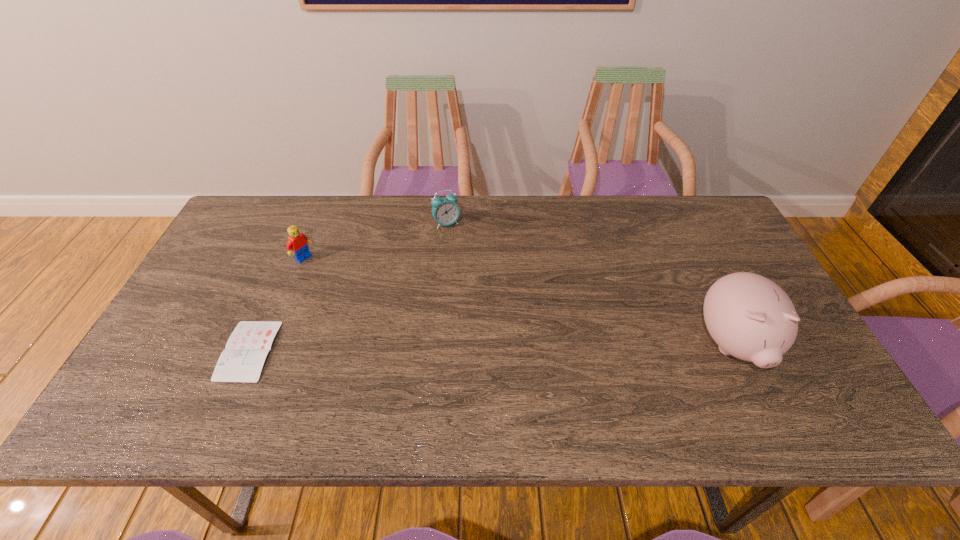
At what (x,y) coordinates should I click in order to perform the action: click on free space on the desktop that is between the shortest object and the piggy bank and is positioned on the face of the farthest object. Please return your answer as a coordinate pair (x, y). The image size is (960, 540). Looking at the image, I should click on (557, 347).

Where is `free space on the desktop that is between the shortest object and the tallest object and is positioned on the face of the Lego`? free space on the desktop that is between the shortest object and the tallest object and is positioned on the face of the Lego is located at coordinates (440, 348).